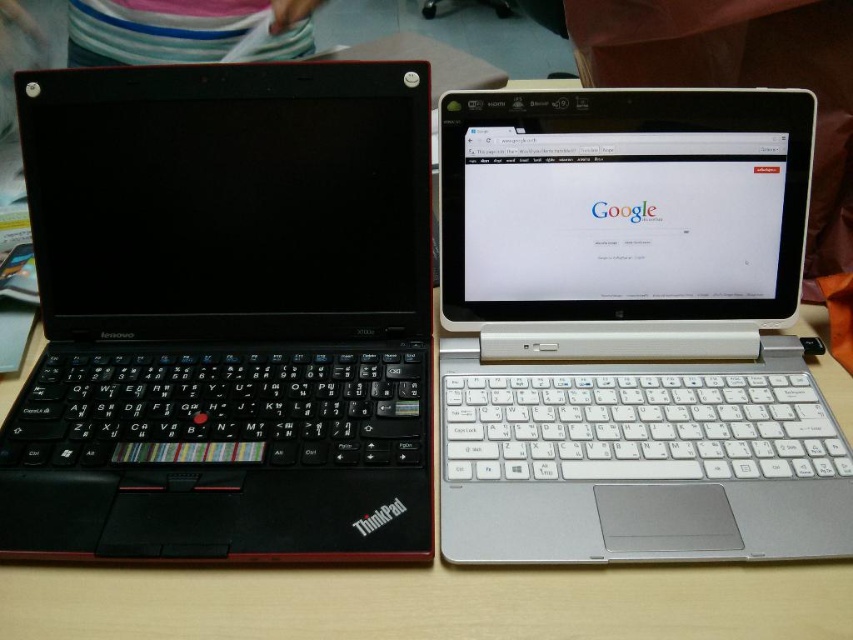
Does black matte keyboard at left lie in front of wooden table at center?

No, black matte keyboard at left is behind wooden table at center.

Can you confirm if black matte keyboard at left is wider than wooden table at center?

Incorrect, black matte keyboard at left's width does not surpass wooden table at center's.

Does point (399, 397) come closer to viewer compared to point (346, 568)?

No.

Find the location of a particular element. The height and width of the screenshot is (640, 853). black matte keyboard at left is located at coordinates (224, 314).

Is black matte keyboard at left below white plastic laptop at center?

No.

Which is below, black matte keyboard at left or white plastic laptop at center?

white plastic laptop at center is below.

This screenshot has height=640, width=853. Identify the location of black matte keyboard at left. (224, 314).

Where is `black matte keyboard at left`? black matte keyboard at left is located at coordinates (224, 314).

Can you confirm if white plastic laptop at center is positioned to the right of wooden table at center?

Indeed, white plastic laptop at center is positioned on the right side of wooden table at center.

Find the location of a particular element. white plastic laptop at center is located at coordinates (630, 330).

This screenshot has height=640, width=853. Find the location of `white plastic laptop at center`. white plastic laptop at center is located at coordinates (630, 330).

Where is `white plastic laptop at center`? This screenshot has width=853, height=640. white plastic laptop at center is located at coordinates (630, 330).